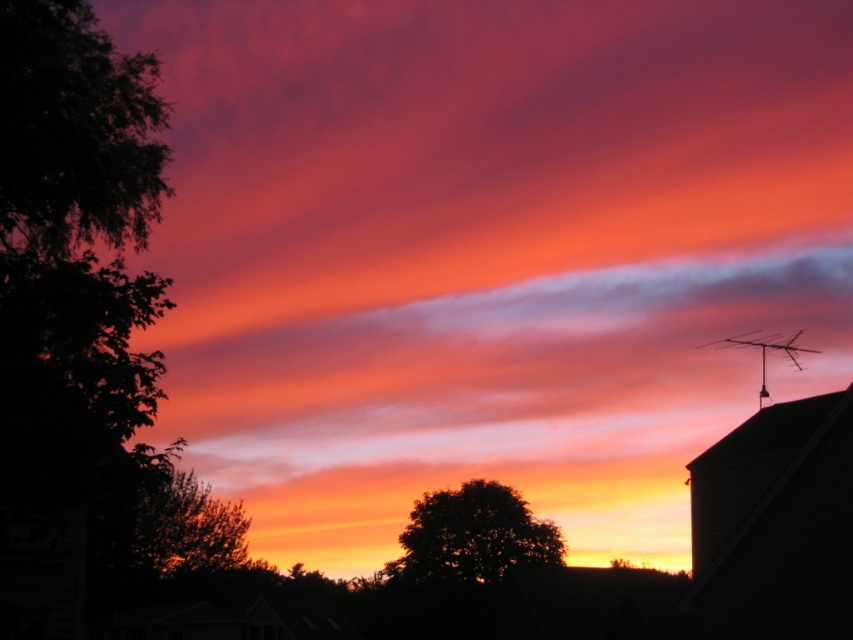
Can you confirm if dark green leafy tree at left is shorter than dark green leafy tree at center?

Yes.

Is dark green leafy tree at left to the left of dark green leafy tree at center from the viewer's perspective?

Yes, dark green leafy tree at left is to the left of dark green leafy tree at center.

Is point (30, 109) farther from viewer compared to point (480, 515)?

No, (30, 109) is in front of (480, 515).

Image resolution: width=853 pixels, height=640 pixels. What are the coordinates of `dark green leafy tree at left` in the screenshot? It's located at point(74,131).

Between dark green leafy tree at center and silky orange tree at center, which one has more height?

silky orange tree at center is taller.

Between point (558, 531) and point (221, 516), which one is positioned in front?

Positioned in front is point (558, 531).

In order to click on dark green leafy tree at center in this screenshot , I will do `click(473, 536)`.

The width and height of the screenshot is (853, 640). Identify the location of dark green leafy tree at center. point(473,536).

Between point (10, 36) and point (132, 528), which one is positioned in front?

Point (10, 36)

Who is lower down, dark green leafy tree at left or silky orange tree at center?

Positioned lower is silky orange tree at center.

Identify the location of dark green leafy tree at left. The height and width of the screenshot is (640, 853). (74, 131).